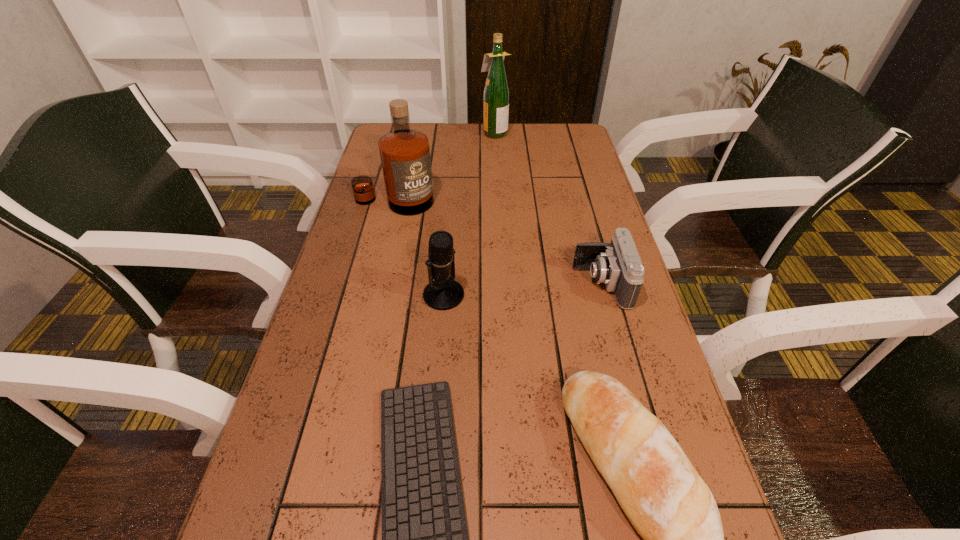
Where is `the right liquor`? the right liquor is located at coordinates (496, 93).

The height and width of the screenshot is (540, 960). Identify the location of the farthest object. (496, 93).

Locate an element on the screen. This screenshot has height=540, width=960. the left liquor is located at coordinates (404, 153).

This screenshot has height=540, width=960. I want to click on the nearer liquor, so (404, 153).

Identify the location of microphone. (441, 294).

I want to click on camera, so click(617, 264).

Image resolution: width=960 pixels, height=540 pixels. What are the coordinates of `vacant space located 0.370m on the front-facing side of the farthest object` in the screenshot? It's located at (381, 132).

Identify the location of vacant area located 0.140m on the front-facing side of the farthest object. This screenshot has height=540, width=960. (444, 132).

Find the location of a particular element. The width and height of the screenshot is (960, 540). vacant space positioned on the front-facing side of the farthest object is located at coordinates (457, 132).

Where is `vacant space situated on the front label of the nearer liquor`? This screenshot has height=540, width=960. vacant space situated on the front label of the nearer liquor is located at coordinates (386, 236).